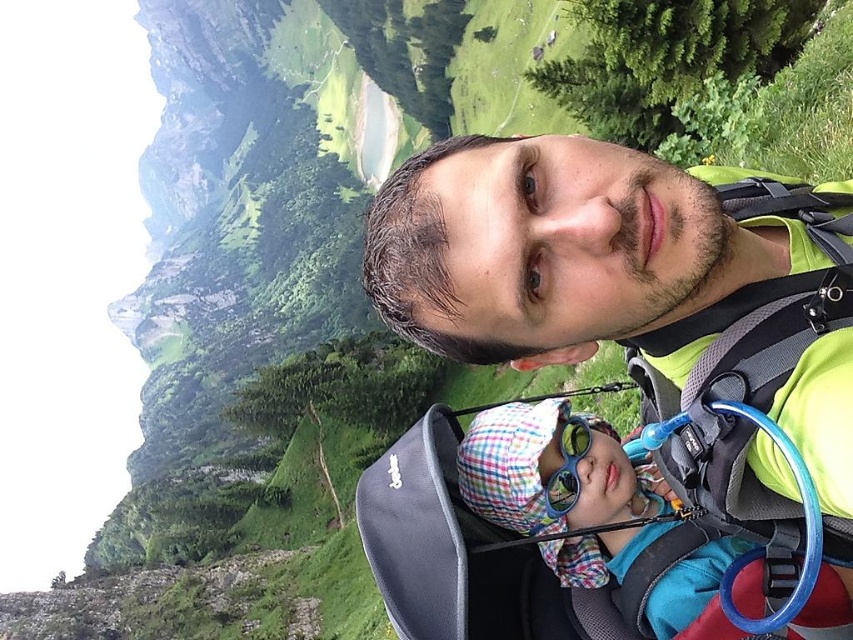
You are a hiker who wants to take a photo of the matte green shirt at upper center and the plaid fabric hat at lower center. Which object should you adjust your camera focus on first to ensure both are in the same focal plane?

The matte green shirt at upper center is in front of the plaid fabric hat at lower center, so you should focus on the matte green shirt at upper center first to ensure both are in the same focal plane.

You are a hiker trying to navigate the mountain path. You see two points marked on your map. The first point is at coordinate point[769,340] and the second point is at coordinate point[552,465]. Which point is closer to your current position if you are standing at the starting point of the path?

Point[769,340] is in front of point[552,465], so it is closer to your current position.

You are a hiker who needs to decide which item to pack first between the matte green shirt at upper center and the plaid fabric hat at lower center. If you want to carry the larger item first, which one should you choose?

The matte green shirt at upper center is bigger than the plaid fabric hat at lower center, so you should choose the matte green shirt at upper center first.